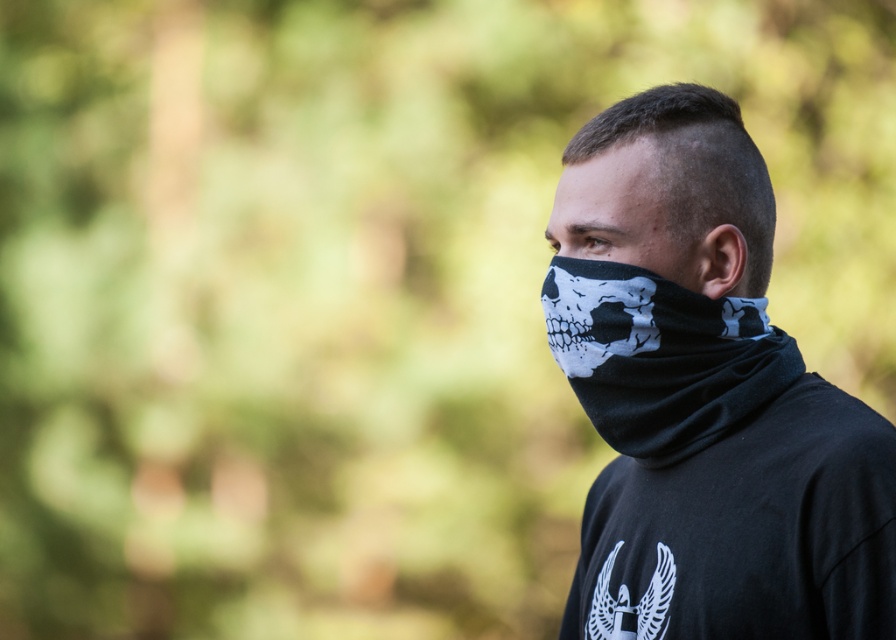
You are an observer looking at the image. You notice the black fabric bandana at right. Where exactly is it positioned in the image?

The black fabric bandana at right is located at point 0.622 on the horizontal axis and 0.787 on the vertical axis.

You are a photographer adjusting your camera settings to capture the scene. You want to ensure both the black fabric bandana at right and the black matte bandana at center are in focus. Given that your camera can only focus on objects within a 10 centimeter range, will both bandanas be in focus?

The black fabric bandana at right and black matte bandana at center are 11.78 centimeters apart from each other. Since the distance between them exceeds the camera focus range of 10 centimeters, both bandanas cannot be in focus simultaneously.

You are a photographer who wants to capture the subject while ensuring both the black fabric bandana at right and the black matte bandana at center are clearly visible. Since the background is blurred, which bandana should you focus on to ensure both are in focus?

Since the black fabric bandana at right is in front of the black matte bandana at center, focusing on the black fabric bandana at right will ensure both are in focus because the black matte bandana at center is behind it and within the same focal plane.